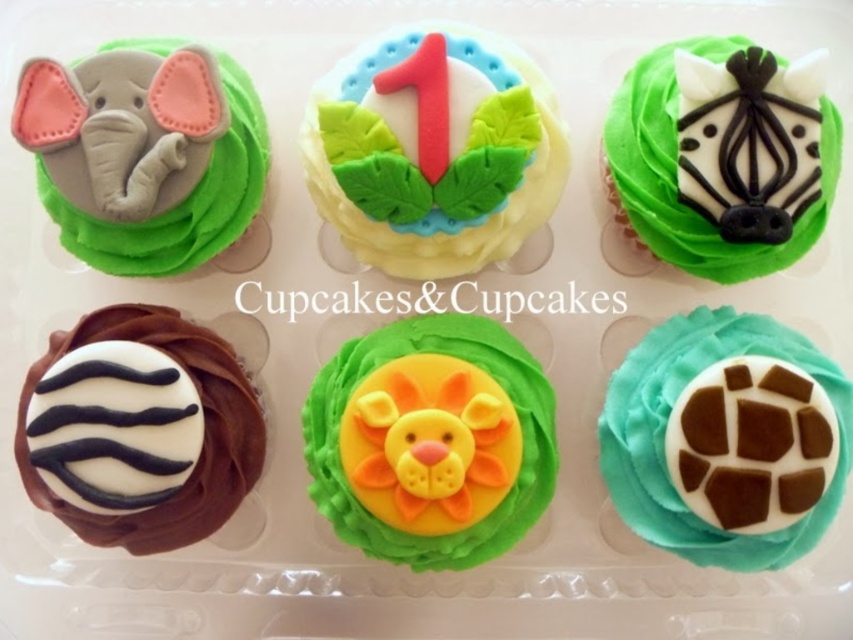
You are planning to stack these cupcakes for a display. Considering the height of the matte gray elephant at upper left and the white matte zebra head at upper right, which one would be more stable to place at the bottom of the stack?

The matte gray elephant at upper left is shorter than the white matte zebra head at upper right. Since shorter items are more stable at the bottom of a stack, the matte gray elephant at upper left should be placed at the bottom for stability.

Which cupcake is located at the coordinates point [144,152]?

The point [144,152] corresponds to the matte gray elephant at upper left.

You are planning to place a small flag exactly at the point marked by coordinates (431,442) on the cupcake tray. Which cupcake will the flag be placed on?

The flag will be placed on the yellow fondant lion at center, as the coordinates point to that location.